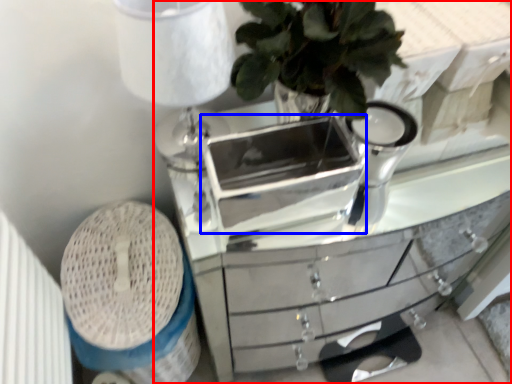
Question: Among these objects, which one is nearest to the camera, chest of drawers (highlighted by a red box) or appliance (highlighted by a blue box)?

Choices:
 (A) chest of drawers
 (B) appliance

Answer: (B)